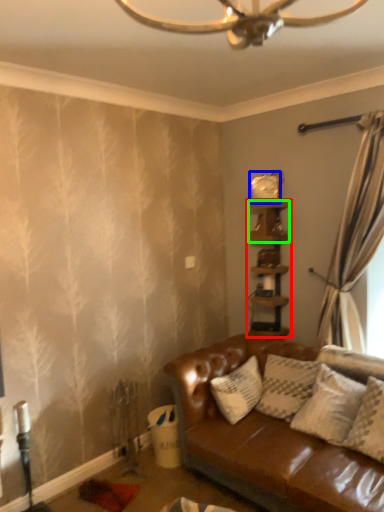
Question: Considering the real-world distances, which object is closest to shelf (highlighted by a red box)? clock (highlighted by a blue box) or shelf (highlighted by a green box).

Choices:
 (A) clock
 (B) shelf

Answer: (B)